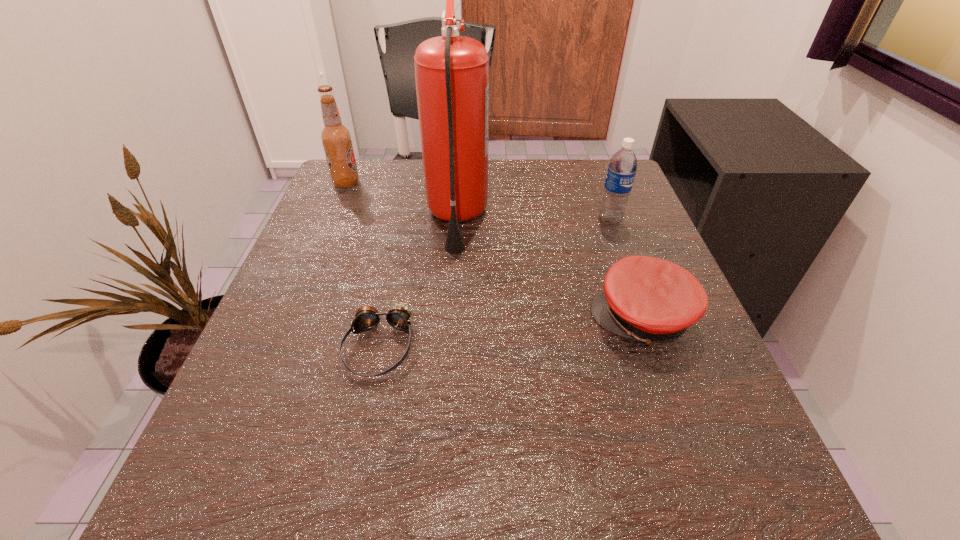
I want to click on free point between the fire extinguisher and the beer bottle, so click(x=401, y=201).

At what (x,y) coordinates should I click in order to perform the action: click on blank region between the fourth tallest object and the leftmost object. Please return your answer as a coordinate pair (x, y). Image resolution: width=960 pixels, height=540 pixels. Looking at the image, I should click on (494, 251).

Locate an element on the screen. The image size is (960, 540). free space between the tallest object and the second tallest object is located at coordinates (401, 201).

Where is `vacant space that is in between the shortest object and the second shortest object`? vacant space that is in between the shortest object and the second shortest object is located at coordinates (511, 333).

Where is `free space that is in between the second shortest object and the goggles`? Image resolution: width=960 pixels, height=540 pixels. free space that is in between the second shortest object and the goggles is located at coordinates (511, 333).

Locate an element on the screen. The height and width of the screenshot is (540, 960). vacant area between the tallest object and the third shortest object is located at coordinates (534, 219).

You are a GUI agent. You are given a task and a screenshot of the screen. Output one action in this format:
    pyautogui.click(x=<x>, y=<y>)
    Task: Click on the free spot between the tallest object and the leftmost object
    The image size is (960, 540).
    Given the screenshot: What is the action you would take?
    pyautogui.click(x=401, y=201)

Find the location of a particular element. The image size is (960, 540). object that stands as the second closest to the fire extinguisher is located at coordinates (336, 138).

Identify the location of the closest object to the third tallest object. The width and height of the screenshot is (960, 540). (652, 300).

In order to click on free spot that satisfies the following two spatial constraints: 1. on the instruction side of the tallest object; 2. on the right side of the third tallest object in this screenshot , I will do `click(457, 220)`.